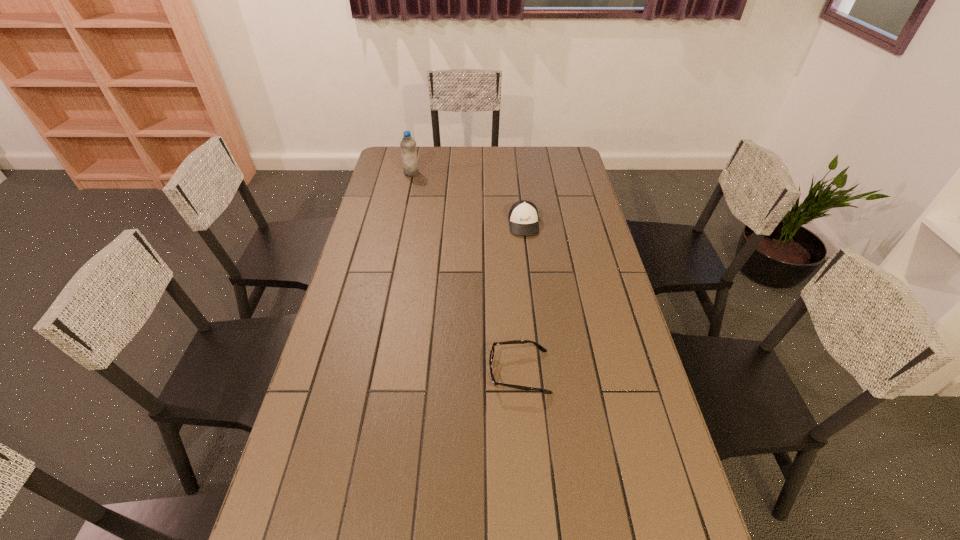
Find the location of a particular element. the farthest object is located at coordinates coord(408,145).

Find the location of `the leftmost object`. the leftmost object is located at coordinates (408, 145).

The height and width of the screenshot is (540, 960). I want to click on the second tallest object, so click(523, 216).

In order to click on cap in this screenshot , I will do (523, 216).

Image resolution: width=960 pixels, height=540 pixels. In order to click on spectacles in this screenshot , I will do `click(539, 346)`.

This screenshot has width=960, height=540. Identify the location of the shortest object. (539, 346).

This screenshot has width=960, height=540. Find the location of `vacant point located 0.180m on the front of the water bottle`. vacant point located 0.180m on the front of the water bottle is located at coordinates (406, 200).

Identify the location of free space located 0.130m on the front panel of the second tallest object. This screenshot has width=960, height=540. (528, 261).

You are a GUI agent. You are given a task and a screenshot of the screen. Output one action in this format:
    pyautogui.click(x=<x>, y=<y>)
    Task: Click on the blank space located on the front-facing side of the nearest object
    The height and width of the screenshot is (540, 960).
    Given the screenshot: What is the action you would take?
    pyautogui.click(x=439, y=372)

The height and width of the screenshot is (540, 960). Find the location of `vacant space located on the front-facing side of the nearest object`. vacant space located on the front-facing side of the nearest object is located at coordinates (449, 372).